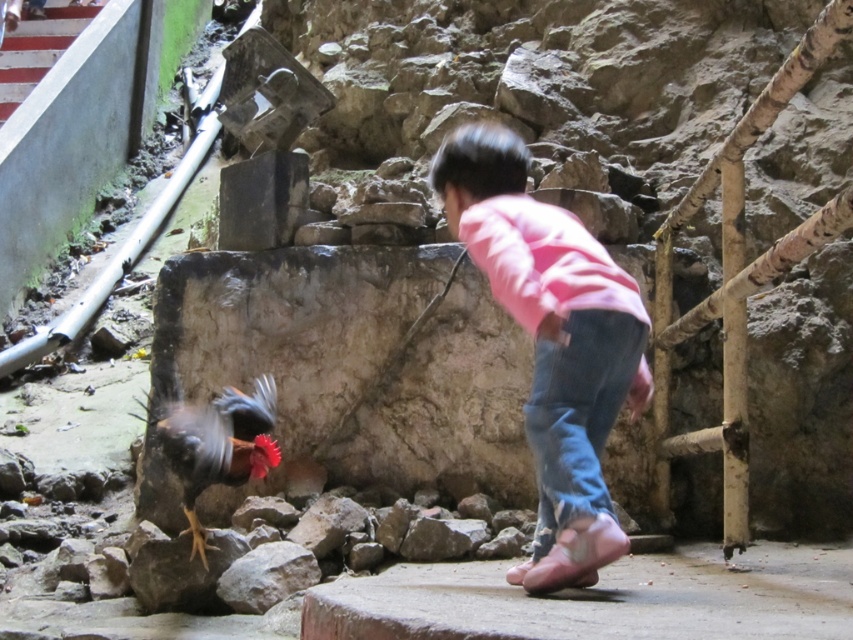
Is point (537, 524) positioned after point (244, 435)?

Yes, point (537, 524) is farther from viewer.

Is point (514, 186) more distant than point (192, 461)?

No, it is in front of (192, 461).

The width and height of the screenshot is (853, 640). Identify the location of pink cotton shirt at center. (552, 342).

Who is shorter, blue denim jeans at lower center or multicolored feathered rooster at center?

multicolored feathered rooster at center

Between blue denim jeans at lower center and multicolored feathered rooster at center, which one is positioned higher?

blue denim jeans at lower center is higher up.

Who is more distant from viewer, (x=595, y=504) or (x=193, y=483)?

Point (x=193, y=483)

Where is `blue denim jeans at lower center`? The height and width of the screenshot is (640, 853). blue denim jeans at lower center is located at coordinates (578, 413).

Find the location of `pink cotton shirt at center`. pink cotton shirt at center is located at coordinates (552, 342).